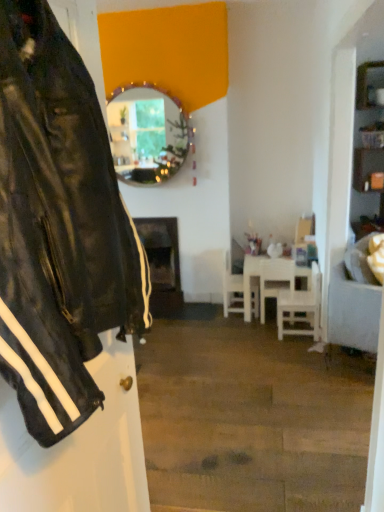
Where is `free space in front of white matte chair at center, the first chair from the right`? free space in front of white matte chair at center, the first chair from the right is located at coordinates [x=291, y=347].